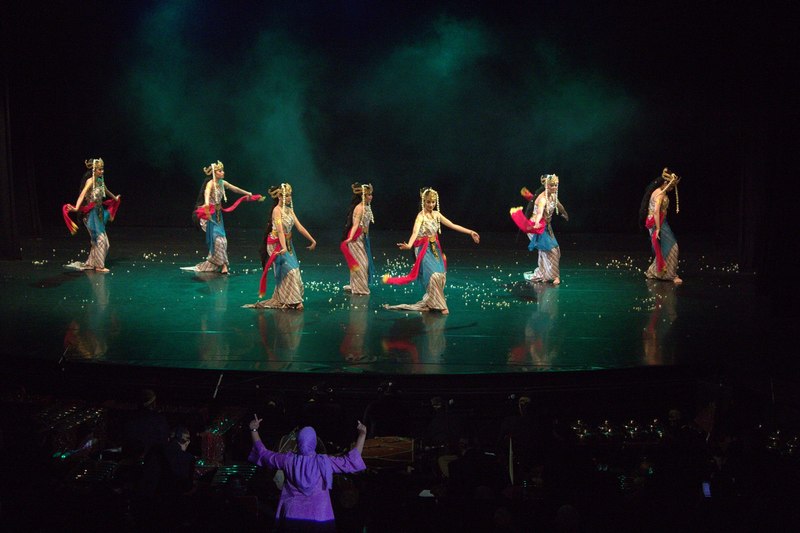
Image resolution: width=800 pixels, height=533 pixels. In order to click on hood in this screenshot , I will do `click(310, 436)`.